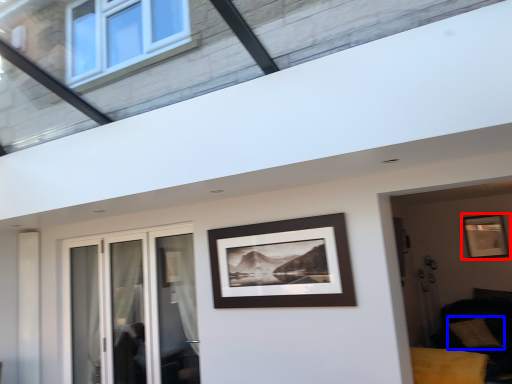
Question: Among these objects, which one is nearest to the camera, picture frame (highlighted by a red box) or pillow (highlighted by a blue box)?

Choices:
 (A) picture frame
 (B) pillow

Answer: (B)